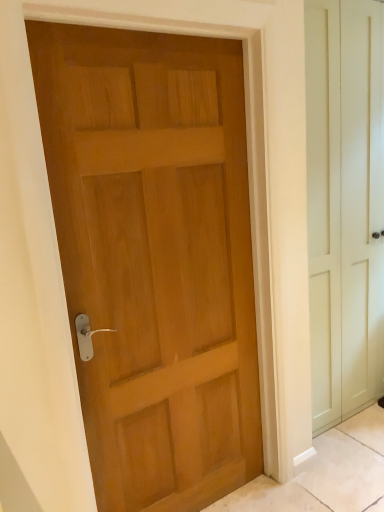
This screenshot has width=384, height=512. Describe the element at coordinates (155, 257) in the screenshot. I see `light brown wood door at center` at that location.

At what (x,y) coordinates should I click in order to perform the action: click on light brown wood door at center. Please return your answer as a coordinate pair (x, y). Looking at the image, I should click on (155, 257).

The width and height of the screenshot is (384, 512). I want to click on light brown wood door at center, so click(x=155, y=257).